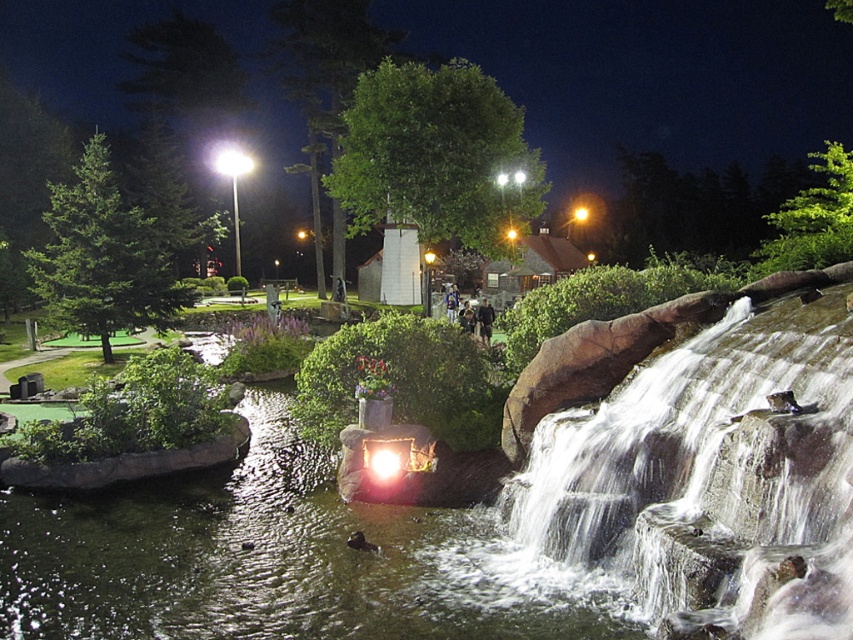
Question: Can you confirm if green leafy trees at upper center is positioned below black fabric person at center?

Choices:
 (A) no
 (B) yes

Answer: (A)

Question: Among these objects, which one is farthest from the camera?

Choices:
 (A) clear water at center
 (B) green leafy trees at upper center
 (C) black fabric person at center
 (D) translucent glass water at center

Answer: (B)

Question: Which of the following is the farthest from the observer?

Choices:
 (A) green leafy trees at upper center
 (B) black fabric person at center
 (C) clear water at center

Answer: (A)

Question: Among these objects, which one is farthest from the camera?

Choices:
 (A) translucent glass water at center
 (B) green leafy trees at upper center
 (C) black fabric person at center

Answer: (B)

Question: Does clear water at center appear on the left side of black fabric person at center?

Choices:
 (A) yes
 (B) no

Answer: (B)

Question: Does green leafy trees at upper center appear on the left side of black fabric person at center?

Choices:
 (A) yes
 (B) no

Answer: (A)